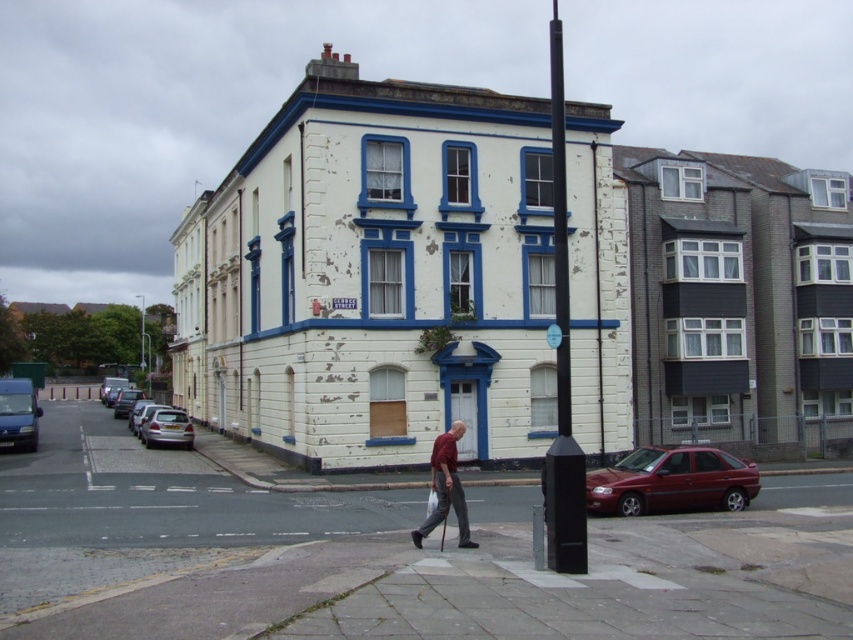
From the picture: Who is more distant from viewer, (x=553, y=500) or (x=173, y=438)?

The point (x=173, y=438) is behind.

Does black plastic pole at center have a greater height compared to silver metallic hatchback at lower left?

Correct, black plastic pole at center is much taller as silver metallic hatchback at lower left.

Where is `black plastic pole at center`? black plastic pole at center is located at coordinates [561, 362].

At what (x,y) coordinates should I click in order to perform the action: click on black plastic pole at center. Please return your answer as a coordinate pair (x, y). This screenshot has width=853, height=640. Looking at the image, I should click on (561, 362).

Is smooth concrete pavement at center to the left of red fabric shirt at center from the viewer's perspective?

Incorrect, smooth concrete pavement at center is not on the left side of red fabric shirt at center.

Describe the element at coordinates (384, 556) in the screenshot. I see `smooth concrete pavement at center` at that location.

You are a GUI agent. You are given a task and a screenshot of the screen. Output one action in this format:
    pyautogui.click(x=<x>, y=<y>)
    Task: Click on the smooth concrete pavement at center
    The image size is (853, 640).
    Given the screenshot: What is the action you would take?
    pyautogui.click(x=384, y=556)

Can you confirm if silver metallic hatchback at lower left is positioned to the right of white plastic street sign at center?

No, silver metallic hatchback at lower left is not to the right of white plastic street sign at center.

Locate an element on the screen. This screenshot has width=853, height=640. silver metallic hatchback at lower left is located at coordinates (167, 428).

Identify the location of silver metallic hatchback at lower left. This screenshot has width=853, height=640. (167, 428).